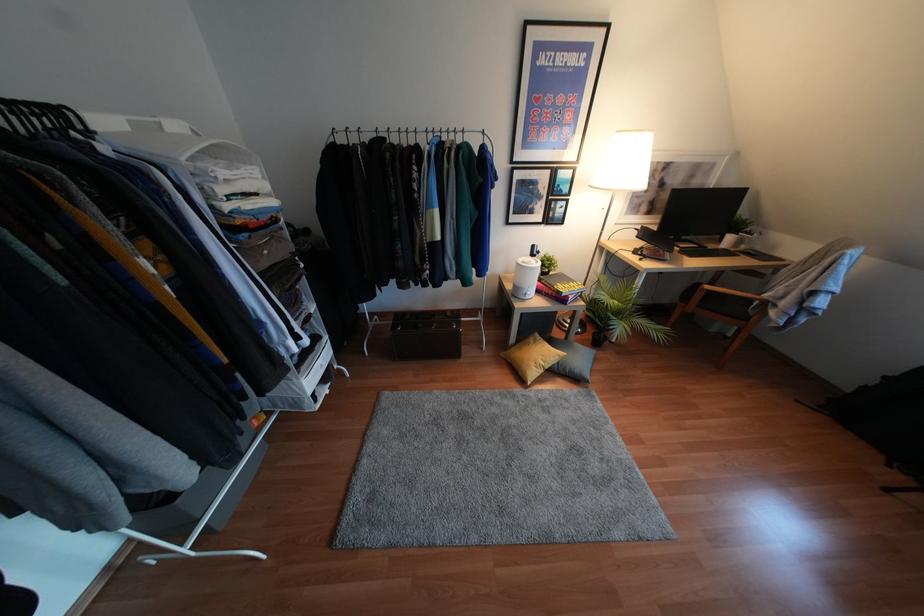
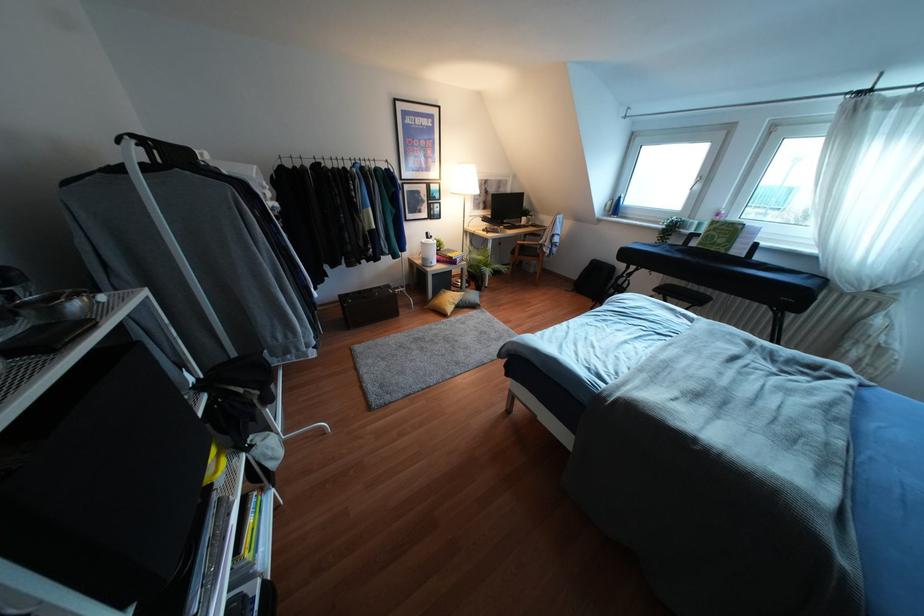
Where in the second image is the point corresponding to pixel 532 246 from the first image?

(427, 233)